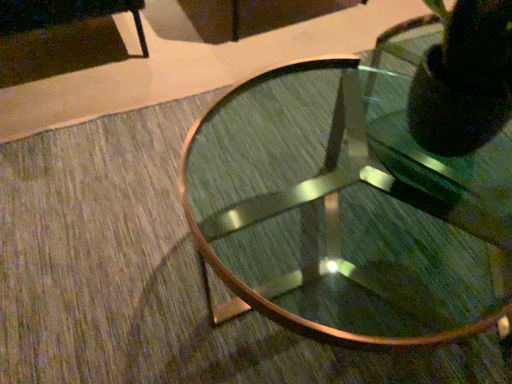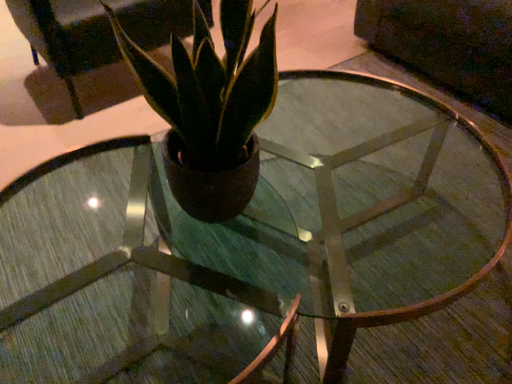
Question: Which way did the camera rotate in the video?

Choices:
 (A) rotated upward
 (B) rotated downward

Answer: (A)